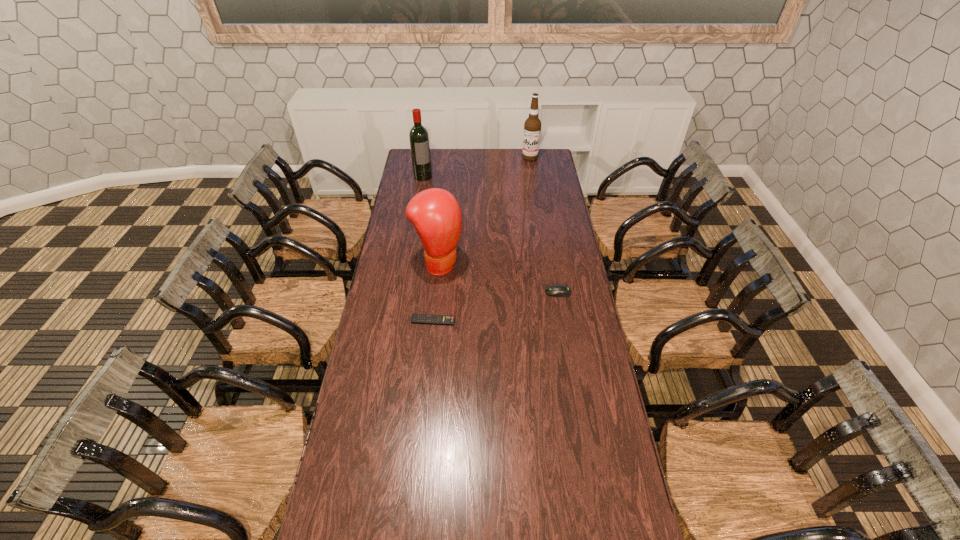
Find the location of a particular element. The height and width of the screenshot is (540, 960). the shortest object is located at coordinates (415, 318).

The width and height of the screenshot is (960, 540). Identify the location of remote control. (415, 318).

You are a GUI agent. You are given a task and a screenshot of the screen. Output one action in this format:
    pyautogui.click(x=<x>, y=<y>)
    Task: Click on the computer mouse
    This screenshot has height=540, width=960.
    Given the screenshot: What is the action you would take?
    pyautogui.click(x=557, y=290)

Find the location of a particular element. the second nearest object is located at coordinates (557, 290).

Locate an element on the screen. the second farthest object is located at coordinates (419, 139).

This screenshot has width=960, height=540. Find the location of `the third farthest object`. the third farthest object is located at coordinates (435, 213).

In order to click on alcohol in this screenshot , I will do `click(532, 127)`.

The width and height of the screenshot is (960, 540). I want to click on blank space located on the back of the shortest object, so click(x=435, y=301).

Identify the location of vacant space positioned on the wheel side of the computer mouse. This screenshot has height=540, width=960. (468, 292).

Locate an element on the screen. Image resolution: width=960 pixels, height=540 pixels. free region located 0.130m on the wheel side of the computer mouse is located at coordinates (515, 292).